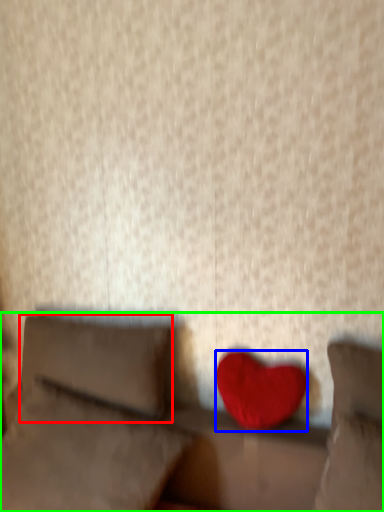
Question: Which object is positioned farthest from pillow (highlighted by a red box)? Select from heart (highlighted by a blue box) and furniture (highlighted by a green box).

Choices:
 (A) heart
 (B) furniture

Answer: (A)